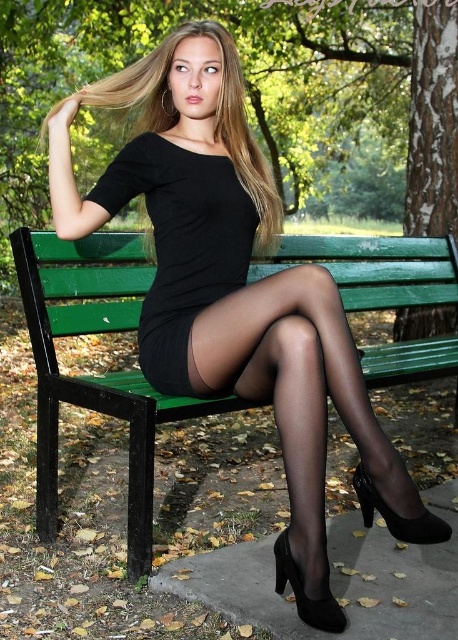
Find the location of a particular element. The image size is (458, 640). black matte dress at center is located at coordinates (181, 244).

Between black sheer tights at center and black sheer stocking at lower center, which one is positioned lower?

black sheer stocking at lower center is below.

Does point (310, 593) come in front of point (343, 618)?

Yes, it is in front of point (343, 618).

At what (x,y) coordinates should I click in order to perform the action: click on black sheer tights at center. Please return your answer as a coordinate pair (x, y). This screenshot has width=458, height=640. Looking at the image, I should click on (306, 417).

Which is more to the left, black sheer tights at center or black matte dress at center?

black matte dress at center

Between black sheer tights at center and black matte dress at center, which one appears on the right side from the viewer's perspective?

black sheer tights at center is more to the right.

This screenshot has height=640, width=458. Describe the element at coordinates (306, 417) in the screenshot. I see `black sheer tights at center` at that location.

Where is `black sheer tights at center`? The width and height of the screenshot is (458, 640). black sheer tights at center is located at coordinates (306, 417).